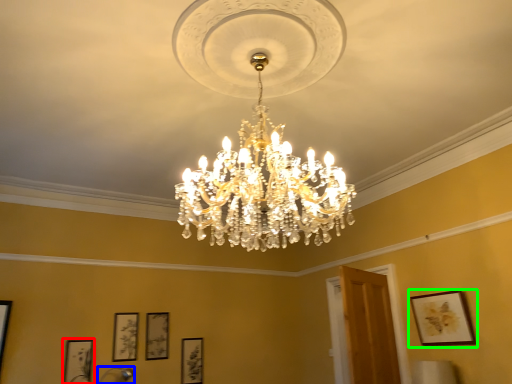
Question: Which object is the farthest from picture frame (highlighted by a red box)? Choose among these: lamp (highlighted by a blue box) or picture frame (highlighted by a green box).

Choices:
 (A) lamp
 (B) picture frame

Answer: (B)